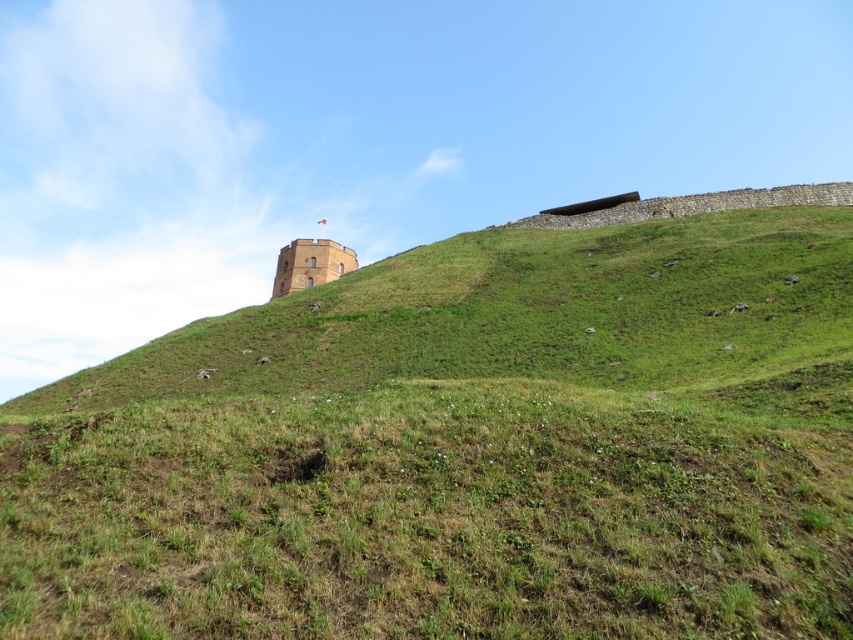
You are planning to build a small garden on the green grassy hill at upper center and the stone tower at upper center. Which location has more space for planting flowers?

The green grassy hill at upper center is bigger than the stone tower at upper center, so it has more space for planting flowers.

You are an archaeologist examining the image of a historical site. You see the green grassy hill at upper center and the stone tower at upper center. Which object is located below the other?

The green grassy hill at upper center is positioned under the stone tower at upper center, meaning the hill is below the tower.